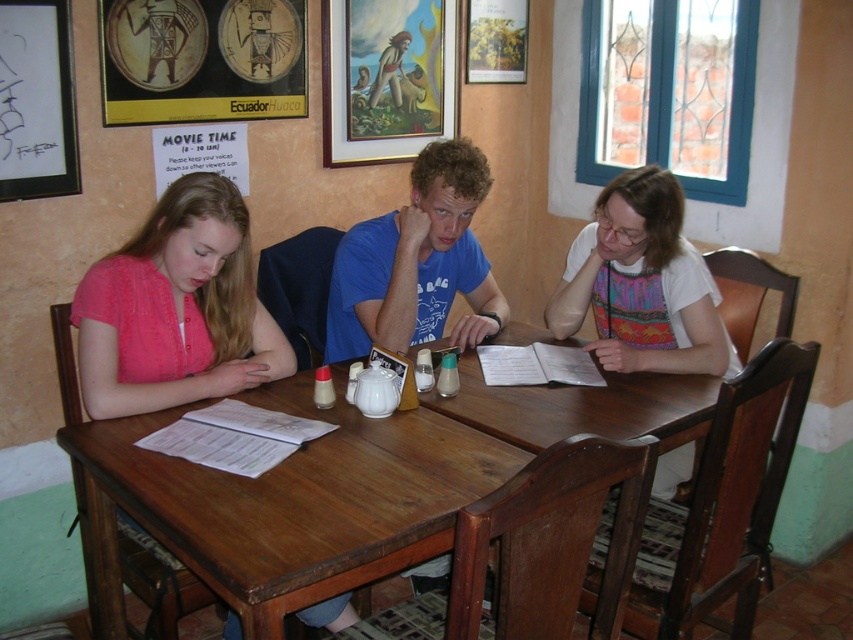
Question: Which point is farther to the camera?

Choices:
 (A) wooden framed painting at upper center
 (B) brown wooden table at center

Answer: (A)

Question: Can you confirm if pink fabric shirt at left is thinner than wooden framed painting at upper center?

Choices:
 (A) yes
 (B) no

Answer: (B)

Question: Can you confirm if pink fabric shirt at left is positioned to the right of blue cotton shirt at center?

Choices:
 (A) yes
 (B) no

Answer: (B)

Question: Which of the following is the farthest from the observer?

Choices:
 (A) (421, 38)
 (B) (221, 336)
 (C) (51, 32)

Answer: (A)

Question: Is brown wooden table at center smaller than blue cotton shirt at center?

Choices:
 (A) yes
 (B) no

Answer: (B)

Question: Which of these objects is positioned farthest from the wooden framed painting at upper center?

Choices:
 (A) blue cotton shirt at center
 (B) black matte picture frame at upper left
 (C) brown wooden table at center

Answer: (C)